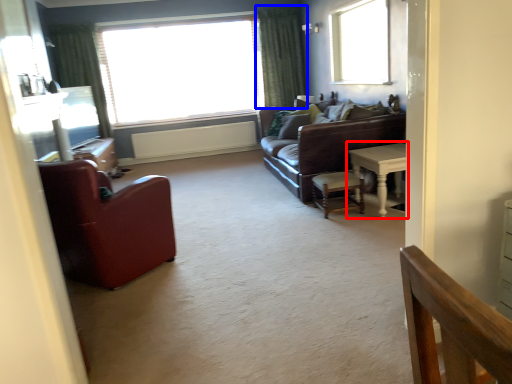
Question: Which point is closer to the camera, table (highlighted by a red box) or curtain (highlighted by a blue box)?

Choices:
 (A) table
 (B) curtain

Answer: (A)